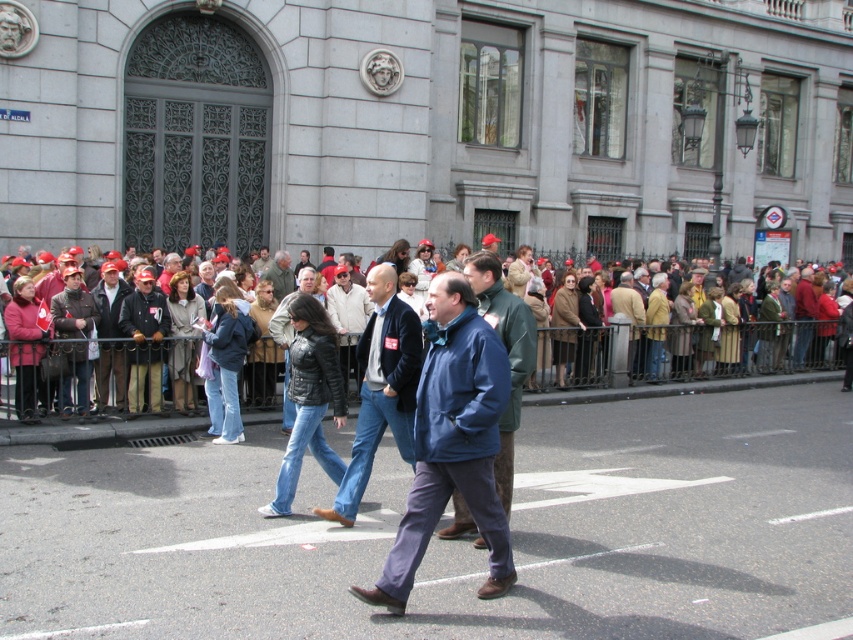
You are standing behind the metal railing observing the procession. You see a leather jacket at center and a green fabric jacket at center. Which one is positioned to the right of the other?

The leather jacket at center is to the right of the green fabric jacket at center.

What are the coordinates of the blue fleece jacket at center?

The blue fleece jacket at center is located at point (451, 442).

You are a photographer standing at the center of the street. You want to take a photo of the leather jacket at center. Where should you aim your camera to capture it in the frame?

You should aim your camera at the point with 2D coordinates of (381, 388) to capture the leather jacket at center in the frame.